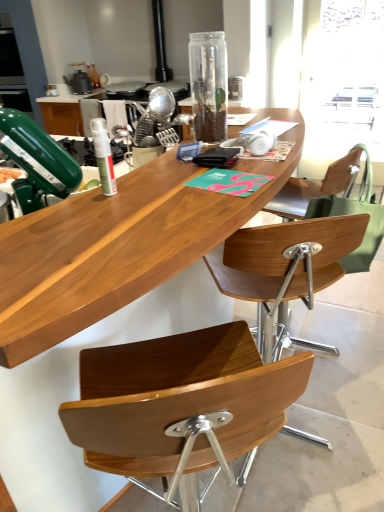
Identify the location of vacant area that lies between transparent glass bottle at center, the second bottle viewed from the left, and white matte spray can at center, which appears as the 1th bottle when viewed from the front. (152, 172).